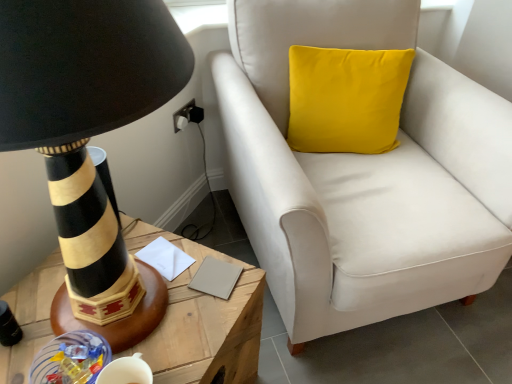
Question: Is the surface of white paper at center, which is the 2th notepad in right-to-left order, in direct contact with black striped lamp at left?

Choices:
 (A) no
 (B) yes

Answer: (A)

Question: Can you confirm if white paper at center, which is the 2th notepad in right-to-left order, is positioned to the right of black striped lamp at left?

Choices:
 (A) no
 (B) yes

Answer: (B)

Question: Considering the relative sizes of white paper at center, which is the 2th notepad in right-to-left order, and black striped lamp at left in the image provided, is white paper at center, which is the 2th notepad in right-to-left order, thinner than black striped lamp at left?

Choices:
 (A) yes
 (B) no

Answer: (A)

Question: From a real-world perspective, is white paper at center, which is the 2th notepad in right-to-left order, on top of black striped lamp at left?

Choices:
 (A) no
 (B) yes

Answer: (A)

Question: Is white paper at center, which is the 2th notepad in right-to-left order, to the left of black striped lamp at left from the viewer's perspective?

Choices:
 (A) no
 (B) yes

Answer: (A)

Question: From the image's perspective, is white paper at center, which is the 2th notepad in right-to-left order, located above or below beige matte notepad at center, which is the 2th notepad in left-to-right order?

Choices:
 (A) below
 (B) above

Answer: (B)

Question: Visually, is white paper at center, the first notepad viewed from the left, positioned to the left or to the right of beige matte notepad at center, which is the 2th notepad in left-to-right order?

Choices:
 (A) right
 (B) left

Answer: (B)

Question: Does point (168, 258) appear closer or farther from the camera than point (223, 276)?

Choices:
 (A) closer
 (B) farther

Answer: (B)

Question: Is white paper at center, which is the 2th notepad in right-to-left order, in front of or behind beige matte notepad at center, which is the 2th notepad in left-to-right order, in the image?

Choices:
 (A) front
 (B) behind

Answer: (B)

Question: Choose the correct answer: Is beige matte notepad at center, which is the 2th notepad in left-to-right order, inside black striped lamp at left or outside it?

Choices:
 (A) outside
 (B) inside

Answer: (B)

Question: Does point 214,269 appear closer or farther from the camera than point 152,317?

Choices:
 (A) closer
 (B) farther

Answer: (B)

Question: Is beige matte notepad at center, the first notepad when ordered from right to left, bigger or smaller than black striped lamp at left?

Choices:
 (A) small
 (B) big

Answer: (A)

Question: Is beige matte notepad at center, which is the 2th notepad in left-to-right order, wider or thinner than black striped lamp at left?

Choices:
 (A) thin
 (B) wide

Answer: (A)

Question: From a real-world perspective, is white paper at center, which is the 2th notepad in right-to-left order, positioned above or below wooden table at left?

Choices:
 (A) above
 (B) below

Answer: (A)

Question: Considering the positions of white paper at center, the first notepad viewed from the left, and wooden table at left in the image, is white paper at center, the first notepad viewed from the left, wider or thinner than wooden table at left?

Choices:
 (A) wide
 (B) thin

Answer: (B)